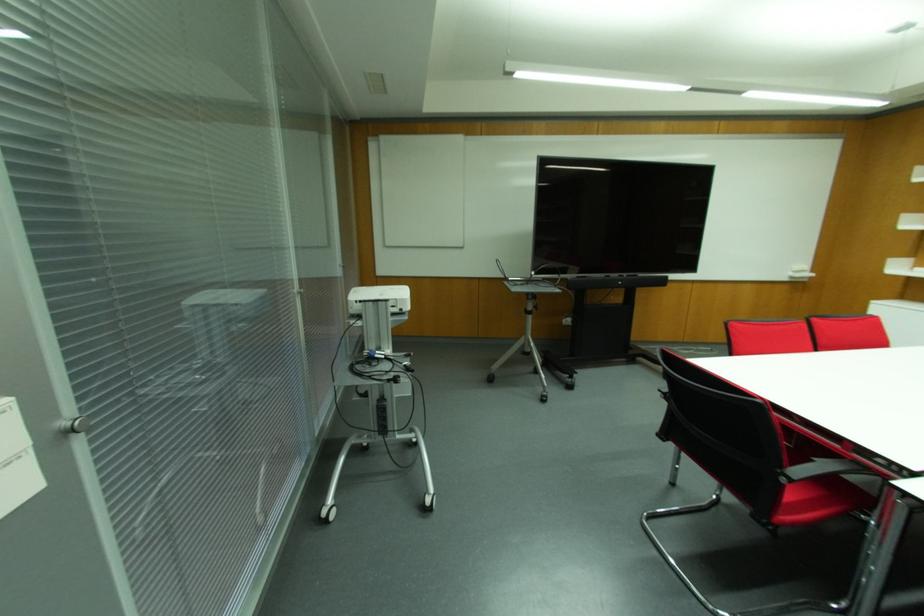
Describe the element at coordinates (820, 499) in the screenshot. The height and width of the screenshot is (616, 924). I see `the red chair sitting surface` at that location.